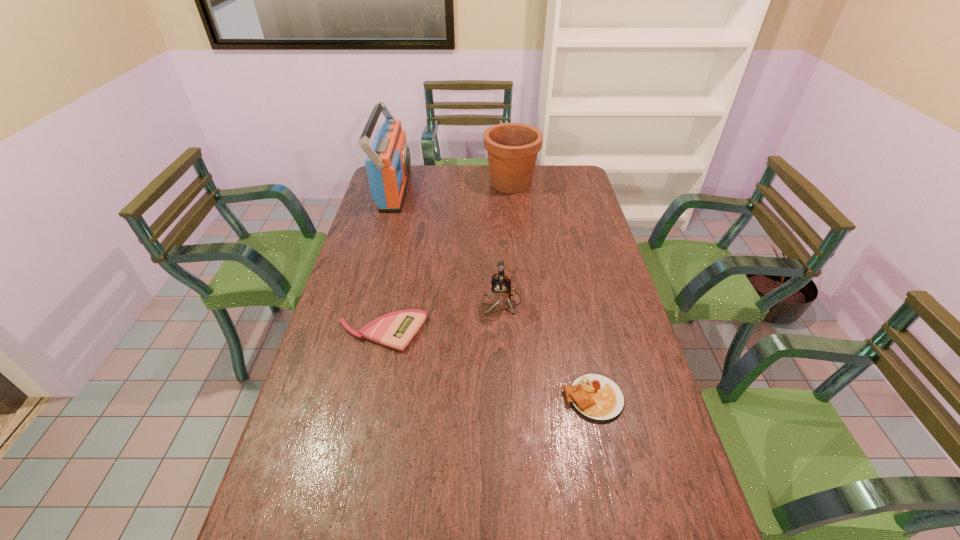
At what (x,y) coordinates should I click in order to perform the action: click on free space located on the left of the nearest object. Please return your answer as a coordinate pair (x, y). Image resolution: width=960 pixels, height=540 pixels. Looking at the image, I should click on click(x=425, y=398).

Identify the location of radio receiver situated at the far edge. (388, 162).

Where is `flowerpot positioned at the far edge`? The image size is (960, 540). flowerpot positioned at the far edge is located at coordinates point(512,148).

I want to click on radio receiver positioned at the left edge, so click(x=388, y=162).

Identify the location of wristlet at the left edge. This screenshot has width=960, height=540. (396, 329).

Where is `object at the right edge`? The height and width of the screenshot is (540, 960). object at the right edge is located at coordinates coord(595,397).

At what (x,y) coordinates should I click in order to perform the action: click on object that is at the far left corner. Please return your answer as a coordinate pair (x, y). The width and height of the screenshot is (960, 540). Looking at the image, I should click on (388, 162).

At what (x,y) coordinates should I click in order to perform the action: click on vacant position at the far edge of the desktop. Please return your answer as a coordinate pair (x, y). This screenshot has height=540, width=960. Looking at the image, I should click on (420, 167).

Find the location of a particular element. vacant space at the left edge of the desktop is located at coordinates (312, 385).

Locate an element on the screen. The width and height of the screenshot is (960, 540). vacant space at the right edge of the desktop is located at coordinates (591, 261).